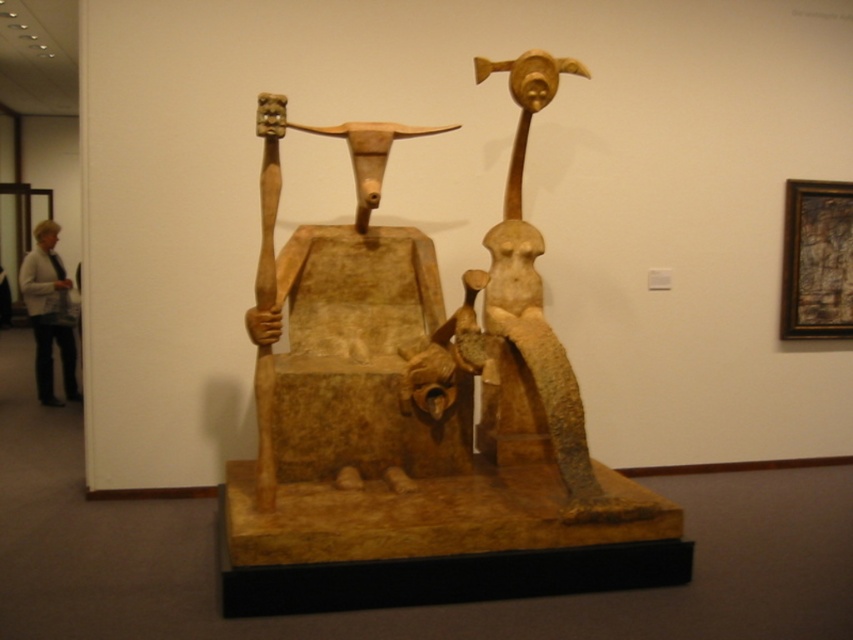
Between point (364, 387) and point (67, 388), which one is positioned behind?

The point (67, 388) is behind.

Can you confirm if matte wood throne at center is positioned below light beige sweater at left?

Correct, matte wood throne at center is located below light beige sweater at left.

The width and height of the screenshot is (853, 640). Describe the element at coordinates (357, 337) in the screenshot. I see `matte wood throne at center` at that location.

Locate an element on the screen. The image size is (853, 640). matte wood throne at center is located at coordinates (357, 337).